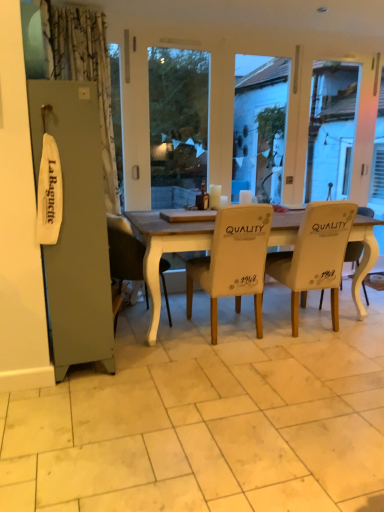
Question: In terms of height, does white leather chair at center, the 3th chair viewed from the right, look taller or shorter compared to white fabric chair at right, positioned as the fourth chair in left-to-right order?

Choices:
 (A) tall
 (B) short

Answer: (A)

Question: Considering their positions, is white leather chair at center, the 2th chair positioned from the left, located in front of or behind white fabric chair at right, arranged as the first chair when viewed from the right?

Choices:
 (A) front
 (B) behind

Answer: (A)

Question: Estimate the real-world distances between objects in this image. Which object is closer to the white leather chair at center, the 3th chair viewed from the right?

Choices:
 (A) white tile at center
 (B) white fabric chair at center, placed as the 3th chair when sorted from left to right
 (C) white fabric chair at center, acting as the 1th chair starting from the left
 (D) white fabric chair at right, arranged as the first chair when viewed from the right

Answer: (B)

Question: Which of these objects is positioned closest to the white leather chair at center, the 2th chair positioned from the left?

Choices:
 (A) white fabric chair at center, which ranks as the 2th chair in right-to-left order
 (B) white tile at center
 (C) white fabric chair at right, positioned as the fourth chair in left-to-right order
 (D) white fabric chair at center, which is counted as the 4th chair, starting from the right

Answer: (A)